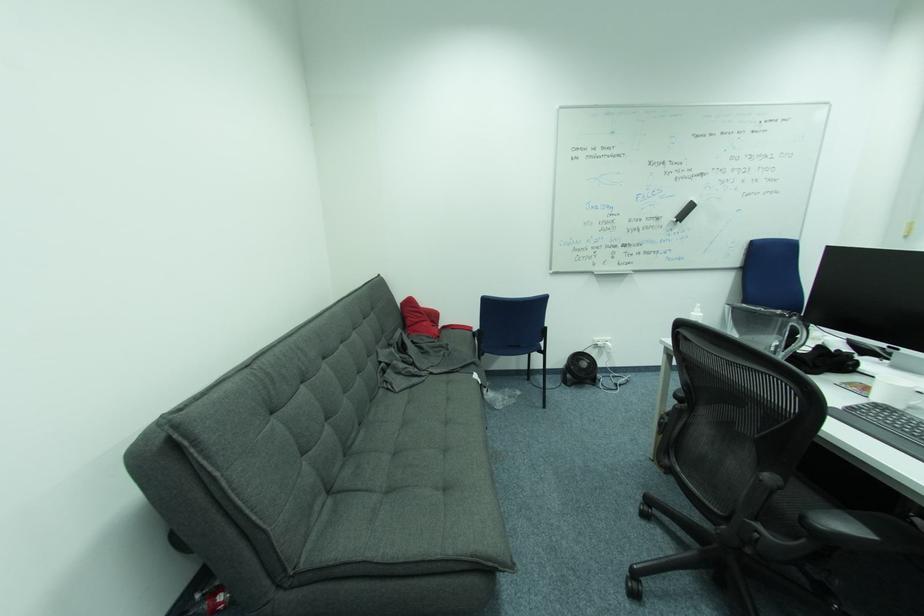
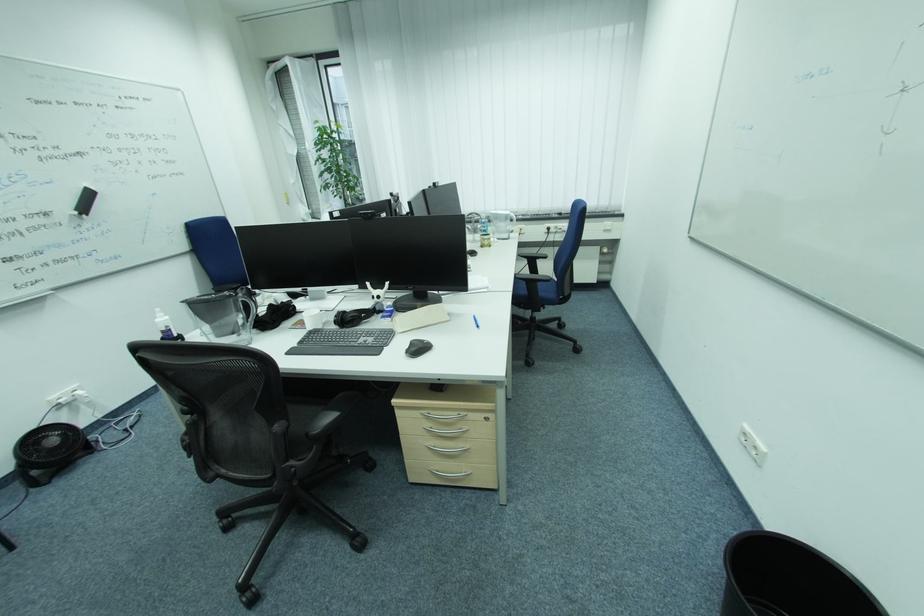
Where in the second image is the point corresponding to point 590,365 from the first image?

(59, 442)